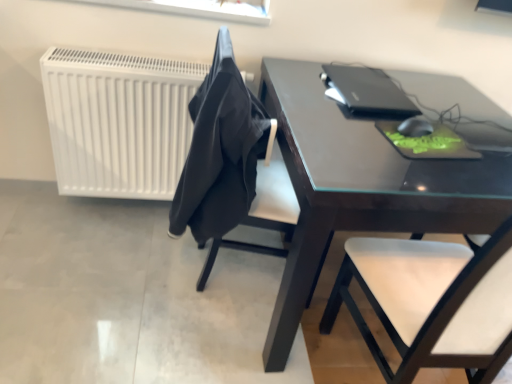
Question: Considering their positions, is black fabric at center located in front of or behind dark brown glossy table at center?

Choices:
 (A) front
 (B) behind

Answer: (B)

Question: From a real-world perspective, is black fabric at center physically located above or below dark brown glossy table at center?

Choices:
 (A) above
 (B) below

Answer: (A)

Question: Estimate the real-world distances between objects in this image. Which object is closer to the white matte radiator at left?

Choices:
 (A) dark brown glossy table at center
 (B) black fabric chair at center
 (C) black matte laptop at upper right
 (D) black matte mouse at upper right
 (E) black fabric at center

Answer: (E)

Question: Based on their relative distances, which object is farther from the black fabric at center?

Choices:
 (A) dark brown glossy table at center
 (B) black fabric chair at center
 (C) black matte laptop at upper right
 (D) white matte radiator at left
 (E) black matte mouse at upper right

Answer: (E)